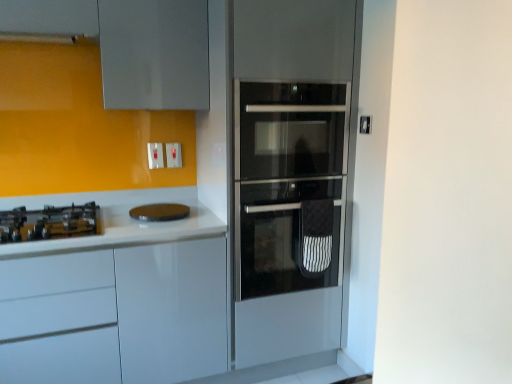
Question: From a real-world perspective, is brown matte cutting board at center on top of white plastic switch at upper center, acting as the second electric outlet starting from the right?

Choices:
 (A) yes
 (B) no

Answer: (B)

Question: Is brown matte cutting board at center behind white plastic switch at upper center, which is counted as the 1th electric outlet, starting from the left?

Choices:
 (A) yes
 (B) no

Answer: (B)

Question: Is brown matte cutting board at center taller than white plastic switch at upper center, which is counted as the 1th electric outlet, starting from the left?

Choices:
 (A) no
 (B) yes

Answer: (A)

Question: Can white plastic switch at upper center, which is counted as the 1th electric outlet, starting from the left, be found inside brown matte cutting board at center?

Choices:
 (A) no
 (B) yes

Answer: (A)

Question: Does brown matte cutting board at center have a smaller size compared to white plastic switch at upper center, which is counted as the 1th electric outlet, starting from the left?

Choices:
 (A) no
 (B) yes

Answer: (A)

Question: Based on their sizes in the image, would you say white plastic switch at upper center, acting as the second electric outlet starting from the right, is bigger or smaller than brown matte cutting board at center?

Choices:
 (A) big
 (B) small

Answer: (B)

Question: In the image, is white plastic switch at upper center, acting as the second electric outlet starting from the right, positioned in front of or behind brown matte cutting board at center?

Choices:
 (A) front
 (B) behind

Answer: (B)

Question: From the image's perspective, is white plastic switch at upper center, acting as the second electric outlet starting from the right, above or below brown matte cutting board at center?

Choices:
 (A) above
 (B) below

Answer: (A)

Question: Considering the positions of white plastic switch at upper center, acting as the second electric outlet starting from the right, and brown matte cutting board at center in the image, is white plastic switch at upper center, acting as the second electric outlet starting from the right, wider or thinner than brown matte cutting board at center?

Choices:
 (A) thin
 (B) wide

Answer: (A)

Question: Does point (151, 147) appear closer or farther from the camera than point (173, 165)?

Choices:
 (A) closer
 (B) farther

Answer: (A)

Question: Relative to white plastic switch at upper center, placed as the first electric outlet when sorted from right to left, is white plastic switch at upper center, acting as the second electric outlet starting from the right, in front or behind?

Choices:
 (A) behind
 (B) front

Answer: (B)

Question: Visually, is white plastic switch at upper center, acting as the second electric outlet starting from the right, positioned to the left or to the right of white plastic switch at upper center, the second electric outlet when ordered from left to right?

Choices:
 (A) left
 (B) right

Answer: (A)

Question: From the image's perspective, is white plastic switch at upper center, acting as the second electric outlet starting from the right, positioned above or below white plastic switch at upper center, the second electric outlet when ordered from left to right?

Choices:
 (A) above
 (B) below

Answer: (B)

Question: Based on their sizes in the image, would you say white plastic switch at upper center, acting as the second electric outlet starting from the right, is bigger or smaller than white glossy cabinet at left?

Choices:
 (A) big
 (B) small

Answer: (B)

Question: From the image's perspective, is white plastic switch at upper center, acting as the second electric outlet starting from the right, located above or below white glossy cabinet at left?

Choices:
 (A) below
 (B) above

Answer: (B)